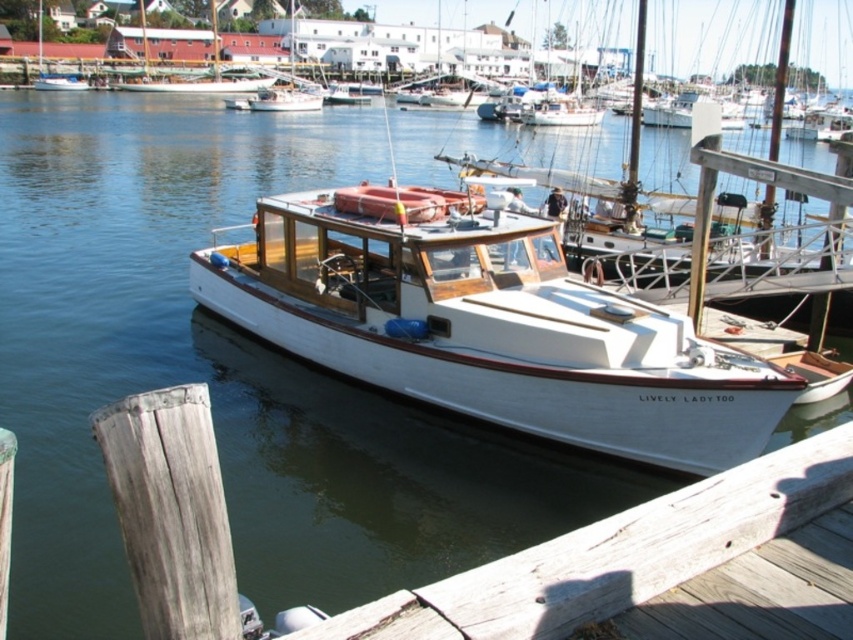
Question: Is white polished wood boat at center thinner than white wood boat at center?

Choices:
 (A) yes
 (B) no

Answer: (A)

Question: Does white polished wood boat at center have a lesser width compared to wooden planks at lower center?

Choices:
 (A) no
 (B) yes

Answer: (B)

Question: Among these points, which one is farthest from the camera?

Choices:
 (A) (294, 108)
 (B) (846, 436)
 (C) (78, 76)
 (D) (740, 410)

Answer: (C)

Question: Is white polished wood boat at center to the right of wooden planks at lower center from the viewer's perspective?

Choices:
 (A) no
 (B) yes

Answer: (B)

Question: Which object appears farthest from the camera in this image?

Choices:
 (A) white polished wood boat at center
 (B) white glossy boat at center
 (C) wooden planks at lower center
 (D) white wood boat at center

Answer: (B)

Question: Which point is farther to the camera?

Choices:
 (A) (257, 100)
 (B) (70, 83)
 (C) (785, 406)
 (D) (474, 627)

Answer: (B)